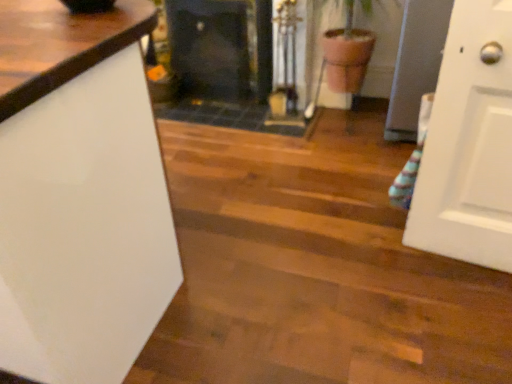
Question: From the image's perspective, is white glossy countertop at left below black glass fireplace at center, the 1th fireplace from the right?

Choices:
 (A) yes
 (B) no

Answer: (A)

Question: Can you confirm if white glossy countertop at left is wider than black glass fireplace at center, the 1th fireplace from the right?

Choices:
 (A) no
 (B) yes

Answer: (B)

Question: Is black glass fireplace at center, the 1th fireplace from the right, located within white glossy countertop at left?

Choices:
 (A) yes
 (B) no

Answer: (B)

Question: From a real-world perspective, is white glossy countertop at left below black glass fireplace at center, the 1th fireplace from the right?

Choices:
 (A) yes
 (B) no

Answer: (B)

Question: Does white glossy countertop at left turn towards black glass fireplace at center, the second fireplace viewed from the left?

Choices:
 (A) no
 (B) yes

Answer: (B)

Question: Considering the relative positions of white glossy countertop at left and black glass fireplace at center, the second fireplace viewed from the left, in the image provided, is white glossy countertop at left to the left or to the right of black glass fireplace at center, the second fireplace viewed from the left,?

Choices:
 (A) right
 (B) left

Answer: (B)

Question: Based on their sizes in the image, would you say white glossy countertop at left is bigger or smaller than black glass fireplace at center, the second fireplace viewed from the left?

Choices:
 (A) small
 (B) big

Answer: (B)

Question: Looking at their shapes, would you say white glossy countertop at left is wider or thinner than black glass fireplace at center, the 1th fireplace from the right?

Choices:
 (A) wide
 (B) thin

Answer: (A)

Question: From the image's perspective, is white glossy countertop at left located above or below black glass fireplace at center, the second fireplace viewed from the left?

Choices:
 (A) above
 (B) below

Answer: (B)

Question: Is black glass fireplace at center, which ranks as the first fireplace in left-to-right order, wider or thinner than white glossy countertop at left?

Choices:
 (A) thin
 (B) wide

Answer: (A)

Question: Does point (189, 64) appear closer or farther from the camera than point (92, 246)?

Choices:
 (A) closer
 (B) farther

Answer: (B)

Question: From the image's perspective, is black glass fireplace at center, which ranks as the first fireplace in left-to-right order, positioned above or below white glossy countertop at left?

Choices:
 (A) below
 (B) above

Answer: (B)

Question: Choose the correct answer: Is black glass fireplace at center, arranged as the 2th fireplace when viewed from the right, inside white glossy countertop at left or outside it?

Choices:
 (A) inside
 (B) outside

Answer: (B)

Question: Considering the positions of point (261, 130) and point (83, 347), is point (261, 130) closer or farther from the camera than point (83, 347)?

Choices:
 (A) farther
 (B) closer

Answer: (A)

Question: Is black glass fireplace at center, the 1th fireplace from the right, inside or outside of white glossy countertop at left?

Choices:
 (A) inside
 (B) outside

Answer: (B)